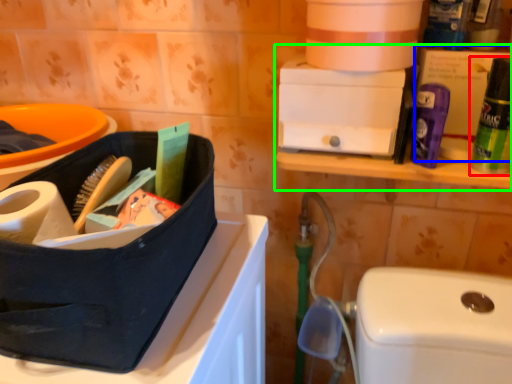
Question: Which object is the closest to the cleaning product (highlighted by a red box)? Choose among these: storage box (highlighted by a blue box) or shelf (highlighted by a green box).

Choices:
 (A) storage box
 (B) shelf

Answer: (A)